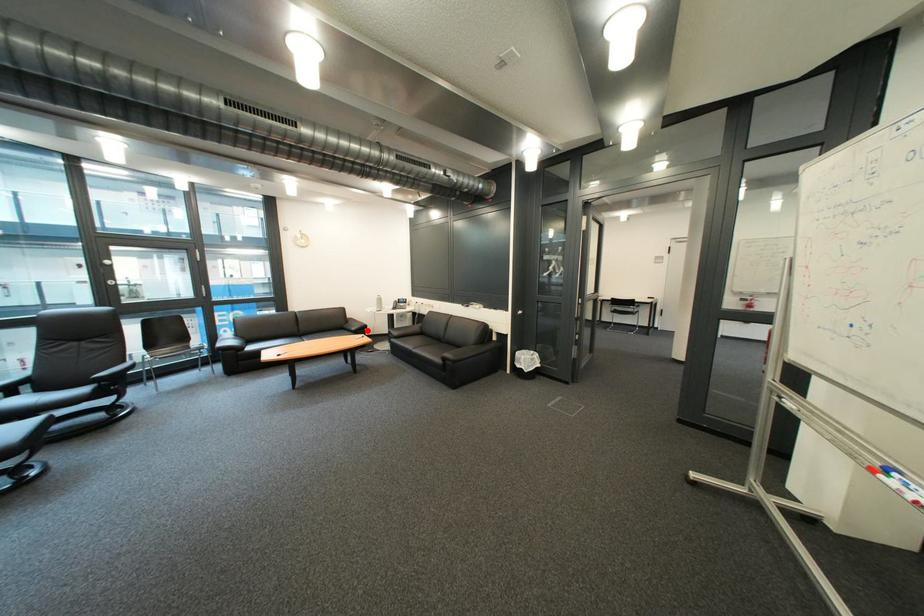
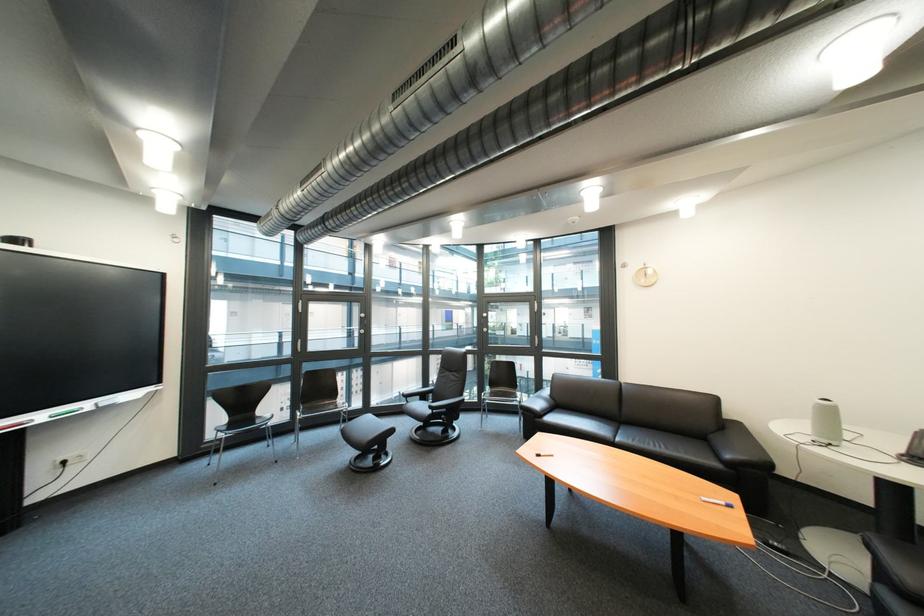
Where in the second image is the point corresponding to the highlighted location from the first image?

(742, 458)